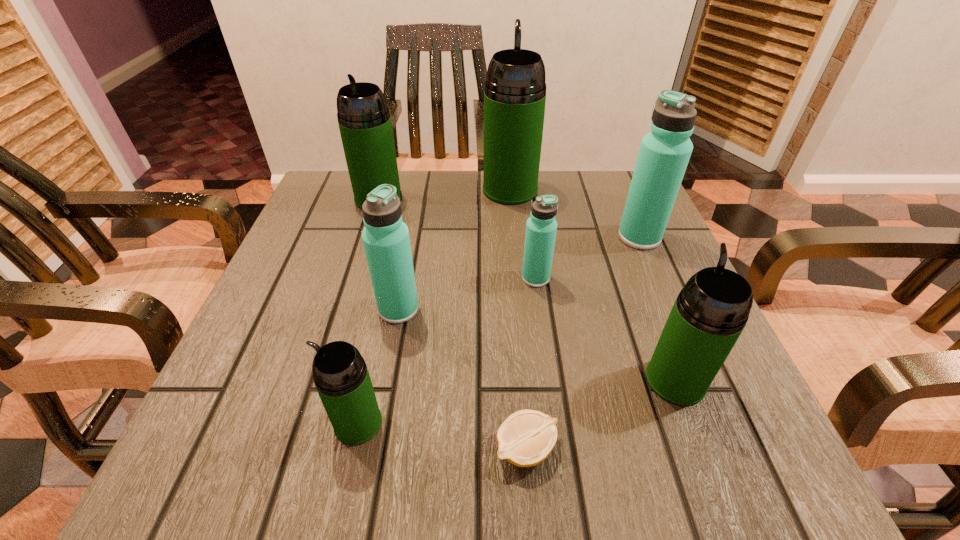
In the image, there is a desktop. Identify the location of vacant space at the far left corner. (316, 193).

You are a GUI agent. You are given a task and a screenshot of the screen. Output one action in this format:
    pyautogui.click(x=<x>, y=<y>)
    Task: Click on the free space between the third nearest thermos bottle and the biggest green thermos bottle
    The width and height of the screenshot is (960, 540).
    Given the screenshot: What is the action you would take?
    pyautogui.click(x=454, y=249)

The width and height of the screenshot is (960, 540). I want to click on free space between the rightmost green thermos bottle and the biggest aqua thermos bottle, so click(658, 308).

The width and height of the screenshot is (960, 540). Identify the location of free spot between the lemon and the rightmost aqua thermos bottle. (583, 343).

Locate an element on the screen. vacant space that is in between the third biggest green thermos bottle and the smallest green thermos bottle is located at coordinates (516, 402).

The width and height of the screenshot is (960, 540). I want to click on free spot between the third smallest green thermos bottle and the biggest green thermos bottle, so click(444, 194).

This screenshot has height=540, width=960. What are the coordinates of `blank region between the third farthest thermos bottle and the biggest green thermos bottle` in the screenshot? It's located at (575, 213).

At what (x,y) coordinates should I click in order to perform the action: click on free space between the fifth farthest object and the yellow lemon. Please return your answer as a coordinate pair (x, y). The image size is (960, 540). Looking at the image, I should click on (463, 379).

At what (x,y) coordinates should I click in order to perform the action: click on free space between the nearest aqua thermos bottle and the shortest object. Please return your answer as a coordinate pair (x, y). Looking at the image, I should click on (463, 379).

This screenshot has width=960, height=540. I want to click on free space between the rightmost green thermos bottle and the fifth farthest object, so click(537, 345).